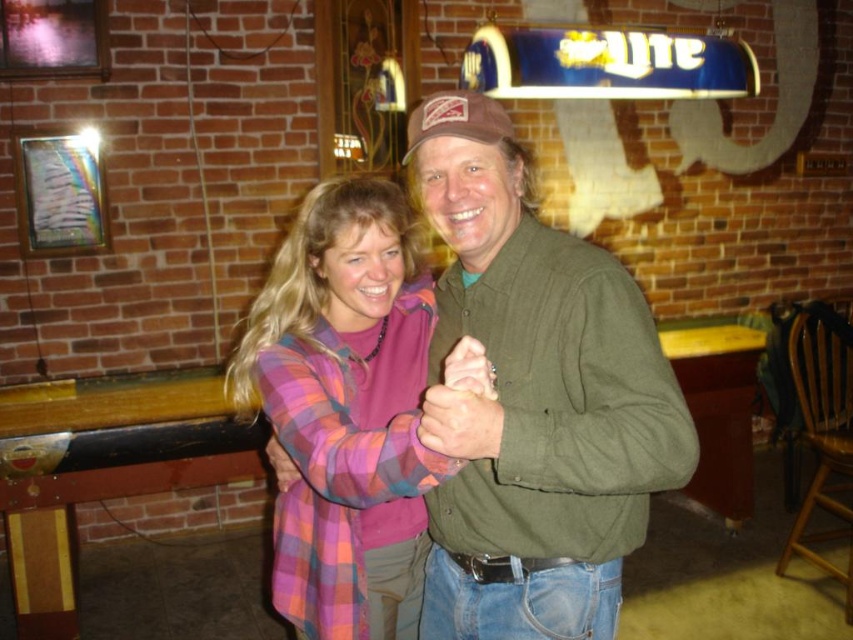
Question: Is plaid shirt at center wider than matte plaid shirt at center?

Choices:
 (A) no
 (B) yes

Answer: (B)

Question: From the image, what is the correct spatial relationship of green cotton shirt at center in relation to plaid shirt at center?

Choices:
 (A) left
 (B) right

Answer: (B)

Question: Estimate the real-world distances between objects in this image. Which object is closer to the brown fabric baseball cap at center?

Choices:
 (A) matte brown ring at center
 (B) green cotton shirt at center
 (C) matte plaid shirt at center
 (D) smooth skin hand at center

Answer: (B)

Question: Which of the following is the closest to the observer?

Choices:
 (A) (434, 404)
 (B) (341, 284)
 (C) (271, 451)

Answer: (A)

Question: Which object is farther from the camera taking this photo?

Choices:
 (A) smooth skin hand at center
 (B) matte plaid shirt at center
 (C) brown fabric baseball cap at center
 (D) matte brown ring at center

Answer: (B)

Question: Does brown fabric baseball cap at center come behind matte brown ring at center?

Choices:
 (A) yes
 (B) no

Answer: (A)